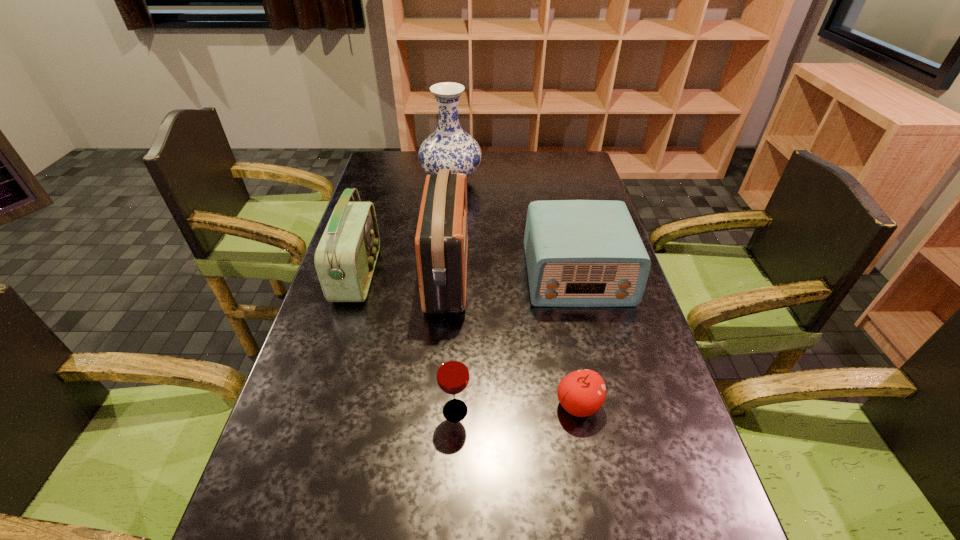
Find the location of `free location located on the front panel of the leftmost object`. free location located on the front panel of the leftmost object is located at coordinates (448, 275).

Locate an element on the screen. This screenshot has height=540, width=960. free region located 0.220m on the front panel of the rightmost radio receiver is located at coordinates (602, 376).

Identify the location of vacant space located 0.180m on the front of the glass. This screenshot has height=540, width=960. (450, 516).

I want to click on free location located 0.050m on the left of the apple, so click(x=532, y=405).

What are the coordinates of `object that is at the far edge` in the screenshot? It's located at (449, 147).

This screenshot has height=540, width=960. Identify the location of object located at the left edge. (345, 258).

This screenshot has width=960, height=540. I want to click on radio receiver at the right edge, so click(579, 253).

Find the location of a particular element. The image size is (960, 540). apple that is at the right edge is located at coordinates 581,393.

Image resolution: width=960 pixels, height=540 pixels. In order to click on free space at the far edge of the desktop in this screenshot , I will do `click(516, 153)`.

The width and height of the screenshot is (960, 540). What are the coordinates of `vacant space at the left edge of the desktop` in the screenshot? It's located at [x=397, y=209].